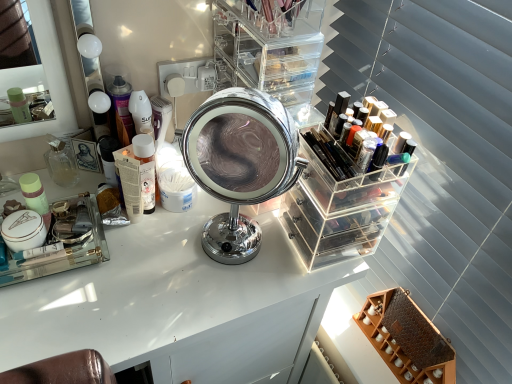
Question: Considering the relative sizes of translucent plastic bottle at left, which is the 2th toiletry from right to left, and translucent glass perfume bottle at left, acting as the first toiletry starting from the back, in the image provided, is translucent plastic bottle at left, which is the 2th toiletry from right to left, wider than translucent glass perfume bottle at left, acting as the first toiletry starting from the back,?

Choices:
 (A) no
 (B) yes

Answer: (A)

Question: From a real-world perspective, is translucent plastic bottle at left, the 2th toiletry when ordered from front to back, located higher than translucent glass perfume bottle at left, the 3th toiletry positioned from the front?

Choices:
 (A) yes
 (B) no

Answer: (B)

Question: Does translucent plastic bottle at left, the 2th toiletry positioned from the back, have a lesser width compared to translucent glass perfume bottle at left, the 3th toiletry positioned from the front?

Choices:
 (A) yes
 (B) no

Answer: (A)

Question: Is translucent plastic bottle at left, which is the 2th toiletry from right to left, with translucent glass perfume bottle at left, positioned as the first toiletry in left-to-right order?

Choices:
 (A) no
 (B) yes

Answer: (A)

Question: Is translucent plastic bottle at left, the 2th toiletry in the left-to-right sequence, positioned beyond the bounds of translucent glass perfume bottle at left, positioned as the first toiletry in left-to-right order?

Choices:
 (A) yes
 (B) no

Answer: (A)

Question: Is white glossy table at center inside or outside of clear glass mirror at upper left?

Choices:
 (A) outside
 (B) inside

Answer: (A)

Question: Considering the relative positions of white glossy table at center and clear glass mirror at upper left in the image provided, is white glossy table at center to the left or to the right of clear glass mirror at upper left?

Choices:
 (A) left
 (B) right

Answer: (B)

Question: From the image's perspective, relative to clear glass mirror at upper left, is white glossy table at center above or below?

Choices:
 (A) above
 (B) below

Answer: (B)

Question: Is white glossy table at center bigger or smaller than clear glass mirror at upper left?

Choices:
 (A) small
 (B) big

Answer: (B)

Question: Is clear acrylic organizer at center, the second shelf when ordered from right to left, wider or thinner than wooden honeycomb-patterned shelf at lower right, positioned as the 1th shelf in bottom-to-top order?

Choices:
 (A) wide
 (B) thin

Answer: (A)

Question: From the image's perspective, relative to wooden honeycomb-patterned shelf at lower right, positioned as the 1th shelf in bottom-to-top order, is clear acrylic organizer at center, positioned as the 1th shelf in left-to-right order, above or below?

Choices:
 (A) below
 (B) above

Answer: (B)

Question: Considering the positions of clear acrylic organizer at center, which is the second shelf in bottom-to-top order, and wooden honeycomb-patterned shelf at lower right, acting as the 2th shelf starting from the left, in the image, is clear acrylic organizer at center, which is the second shelf in bottom-to-top order, bigger or smaller than wooden honeycomb-patterned shelf at lower right, acting as the 2th shelf starting from the left,?

Choices:
 (A) small
 (B) big

Answer: (A)

Question: Is clear acrylic organizer at center, positioned as the 1th shelf in left-to-right order, situated inside wooden honeycomb-patterned shelf at lower right, positioned as the 1th shelf in bottom-to-top order, or outside?

Choices:
 (A) outside
 (B) inside

Answer: (A)

Question: Would you say clear acrylic organizer at center, which appears as the first shelf when viewed from the top, is inside or outside chrome/metallic mirror at center?

Choices:
 (A) outside
 (B) inside

Answer: (A)

Question: Is point (225, 24) closer or farther from the camera than point (291, 129)?

Choices:
 (A) farther
 (B) closer

Answer: (A)